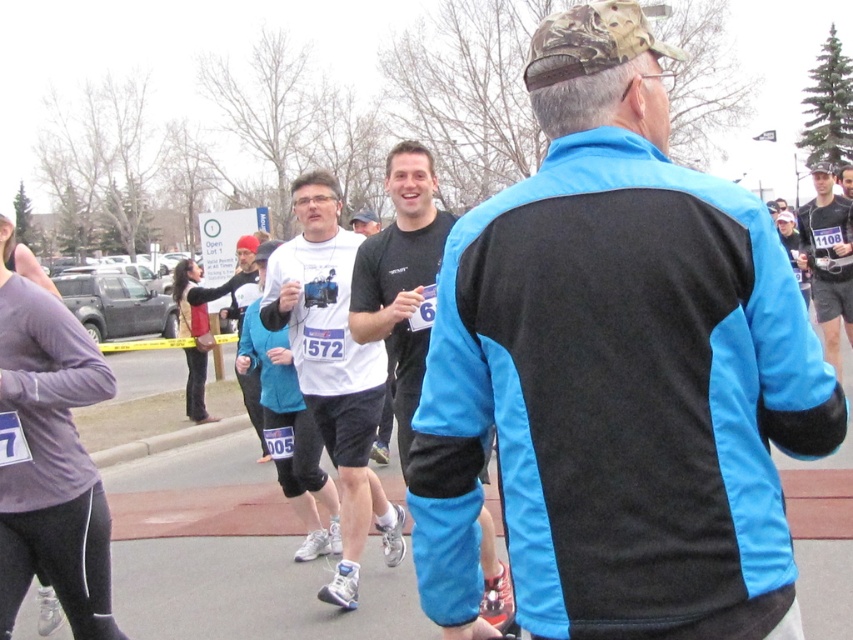
Question: Does purple matte running shirt at lower left have a lesser width compared to white matte t-shirt at center?

Choices:
 (A) yes
 (B) no

Answer: (A)

Question: Among these points, which one is farthest from the camera?

Choices:
 (A) [x=746, y=268]
 (B) [x=380, y=275]

Answer: (B)

Question: Does white matte t-shirt at center have a lesser width compared to matte black shirt at center?

Choices:
 (A) yes
 (B) no

Answer: (A)

Question: Does blue/black jacket at center appear over purple matte running shirt at lower left?

Choices:
 (A) yes
 (B) no

Answer: (A)

Question: Which point is closer to the camera taking this photo?

Choices:
 (A) (357, 260)
 (B) (316, 378)
 (C) (44, 326)

Answer: (C)

Question: Which object is closer to the camera taking this photo?

Choices:
 (A) purple matte running shirt at lower left
 (B) matte black shirt at center
 (C) white matte t-shirt at center

Answer: (A)